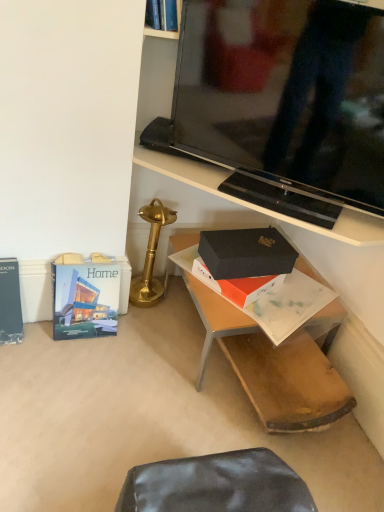
Question: Is point (256, 227) closer or farther from the camera than point (301, 420)?

Choices:
 (A) closer
 (B) farther

Answer: (B)

Question: Do you think black matte box at center is within black matte box at center, or outside of it?

Choices:
 (A) outside
 (B) inside

Answer: (A)

Question: Estimate the real-world distances between objects in this image. Which object is farther from the gold polished table lamp at center?

Choices:
 (A) hardcover book at lower left, which ranks as the second paperback book in left-to-right order
 (B) black glossy tv stand at upper center
 (C) black matte box at center
 (D) black matte box at center
 (E) hardcover book at left, acting as the first paperback book starting from the left

Answer: (B)

Question: Which of these objects is positioned closest to the hardcover book at left, positioned as the second paperback book in right-to-left order?

Choices:
 (A) black matte box at center
 (B) black glossy tv stand at upper center
 (C) gold polished table lamp at center
 (D) hardcover book at lower left, which appears as the 1th paperback book when viewed from the right
 (E) black matte box at center

Answer: (D)